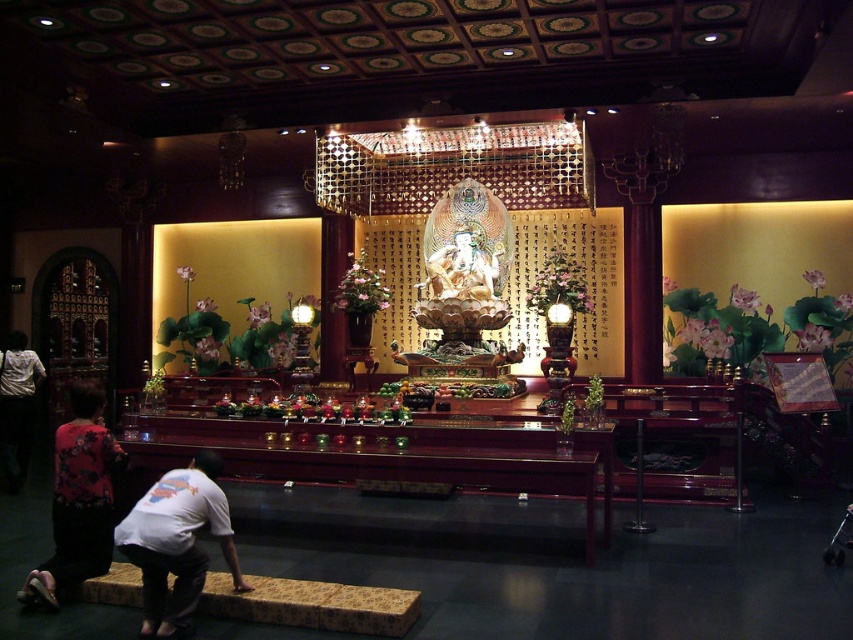
Is white cotton shirt at lower center below floral-patterned fabric at lower left?

Indeed, white cotton shirt at lower center is positioned under floral-patterned fabric at lower left.

Does white cotton shirt at lower center have a greater width compared to floral-patterned fabric at lower left?

Indeed, white cotton shirt at lower center has a greater width compared to floral-patterned fabric at lower left.

This screenshot has width=853, height=640. What do you see at coordinates (177, 544) in the screenshot?
I see `white cotton shirt at lower center` at bounding box center [177, 544].

Where is `white cotton shirt at lower center`? The height and width of the screenshot is (640, 853). white cotton shirt at lower center is located at coordinates pos(177,544).